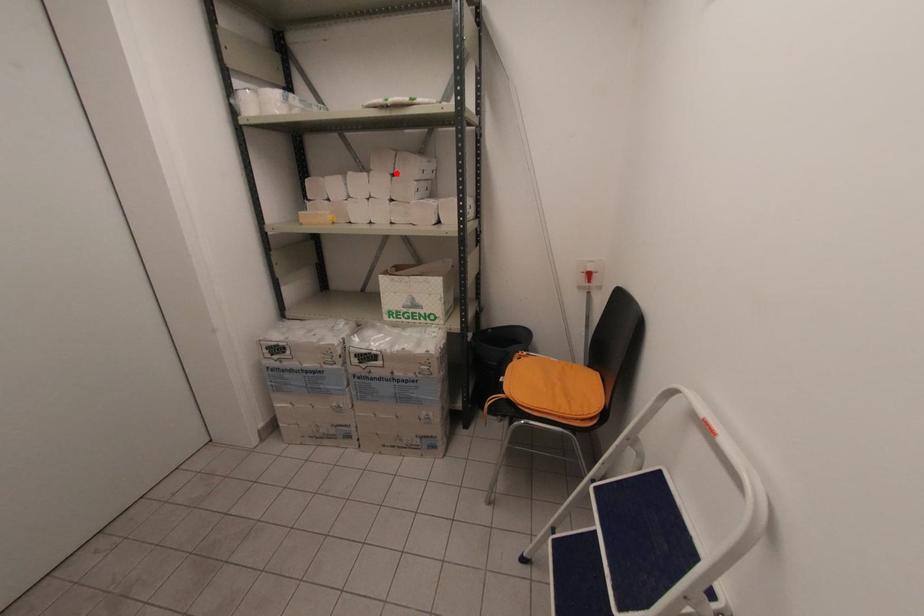
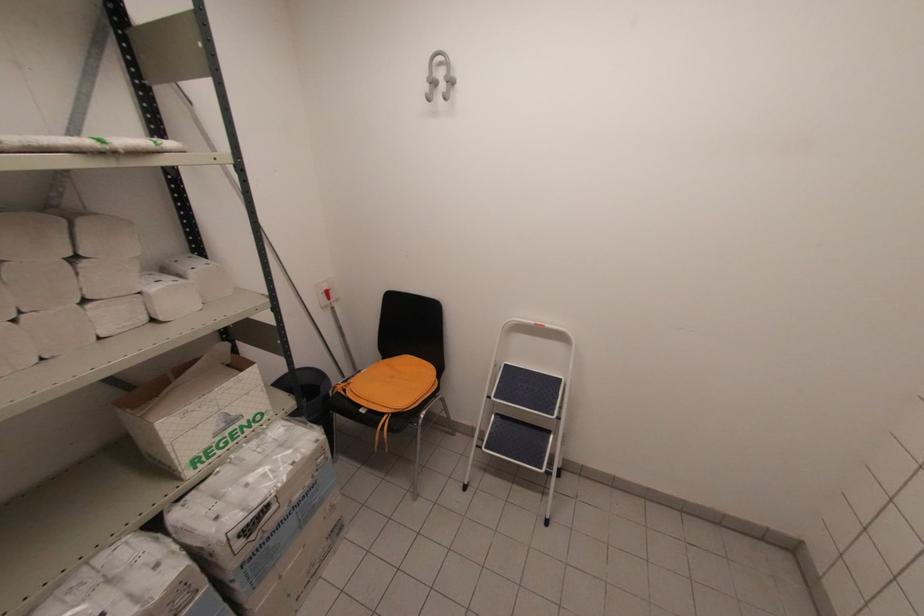
Question: I am providing you with two images of the same scene from different viewpoints. Given a red point in image1, look at the same physical point in image2. Is it:

Choices:
 (A) Closer to the viewpoint
 (B) Farther from the viewpoint

Answer: (B)